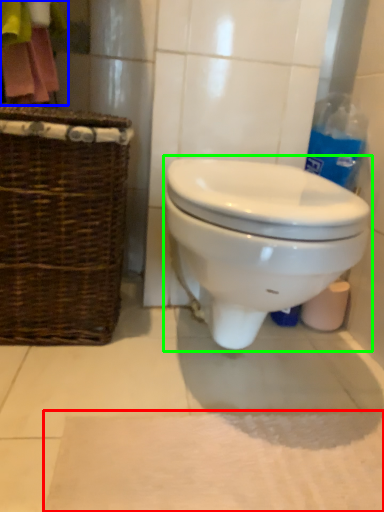
Question: Based on their relative distances, which object is farther from bath mat (highlighted by a red box)? Choose from laundry (highlighted by a blue box) and toilet (highlighted by a green box).

Choices:
 (A) laundry
 (B) toilet

Answer: (A)